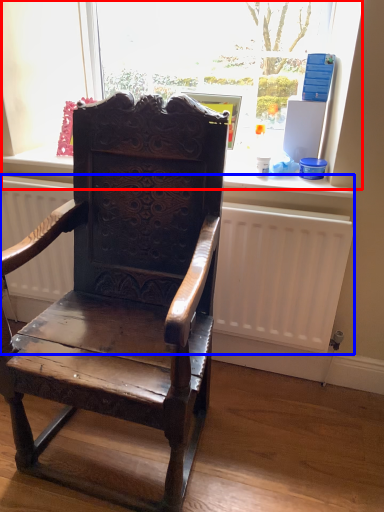
Question: Which point is further to the camera, bay window (highlighted by a red box) or radiator (highlighted by a blue box)?

Choices:
 (A) bay window
 (B) radiator

Answer: (A)